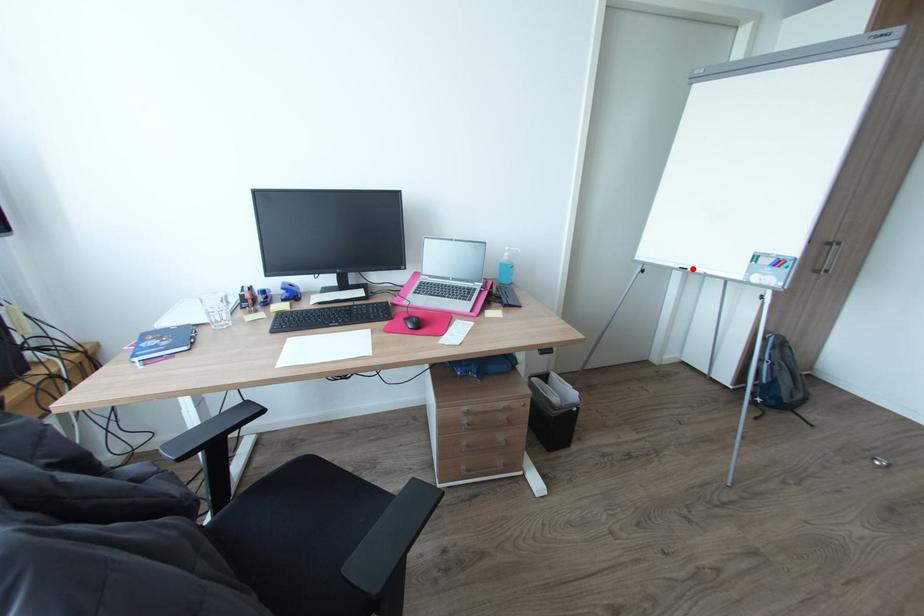
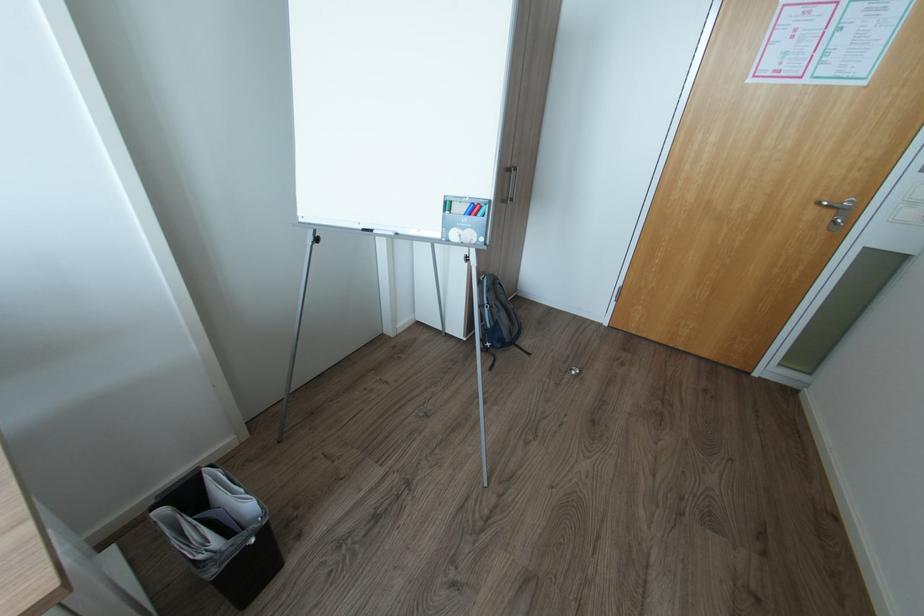
Question: I am providing you with two images of the same scene from different viewpoints. A red point is marked on the first image. At the location where the point appears in image 1, is it still visible in image 2?

Choices:
 (A) Yes
 (B) No

Answer: (A)